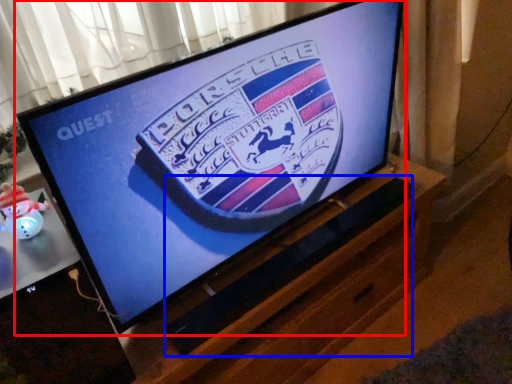
Question: Which object appears farthest to the camera in this image, television (highlighted by a red box) or speaker (highlighted by a blue box)?

Choices:
 (A) television
 (B) speaker

Answer: (B)